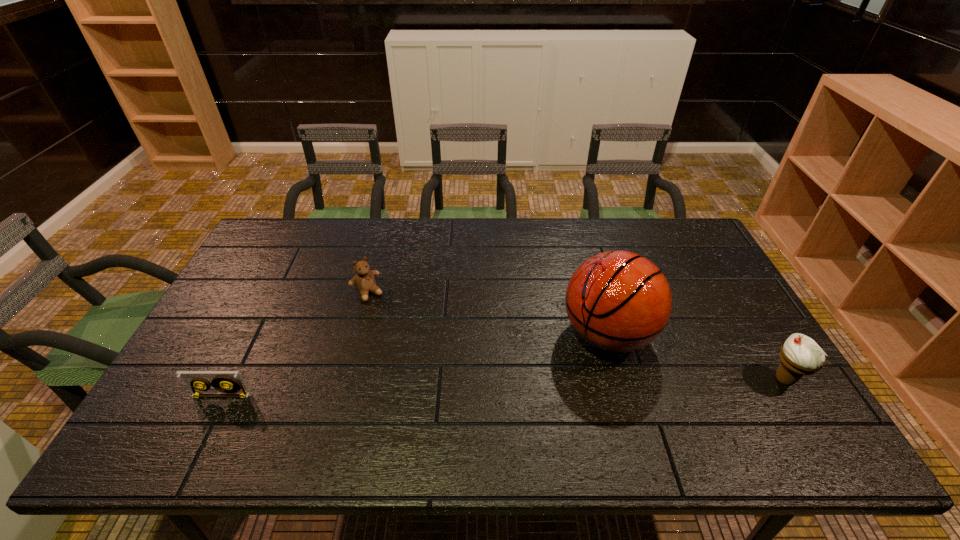
Where is `vacant spot on the desktop that is between the videotape and the rightmost object and is positioned on the side with spill of the second object from right to left`? This screenshot has width=960, height=540. vacant spot on the desktop that is between the videotape and the rightmost object and is positioned on the side with spill of the second object from right to left is located at coordinates (524, 387).

Locate an element on the screen. vacant space on the desktop that is between the videotape and the rightmost object and is positioned on the front-facing side of the teddy bear is located at coordinates (435, 389).